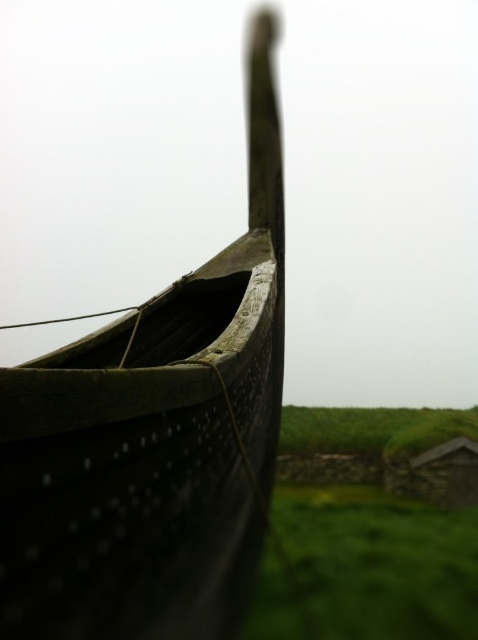
Question: In this image, where is dark wood boat at center located relative to green grassy at lower right?

Choices:
 (A) right
 (B) left

Answer: (B)

Question: Where is dark wood boat at center located in relation to green grassy at lower right in the image?

Choices:
 (A) below
 (B) above

Answer: (B)

Question: Is dark wood boat at center below green grassy at lower right?

Choices:
 (A) yes
 (B) no

Answer: (B)

Question: Among these points, which one is nearest to the camera?

Choices:
 (A) (259, 632)
 (B) (140, 451)

Answer: (B)